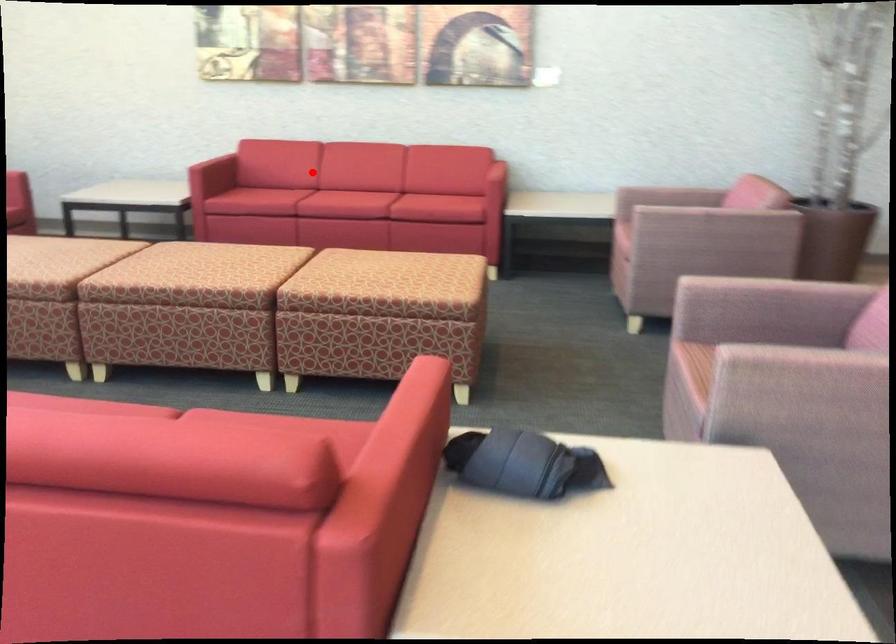
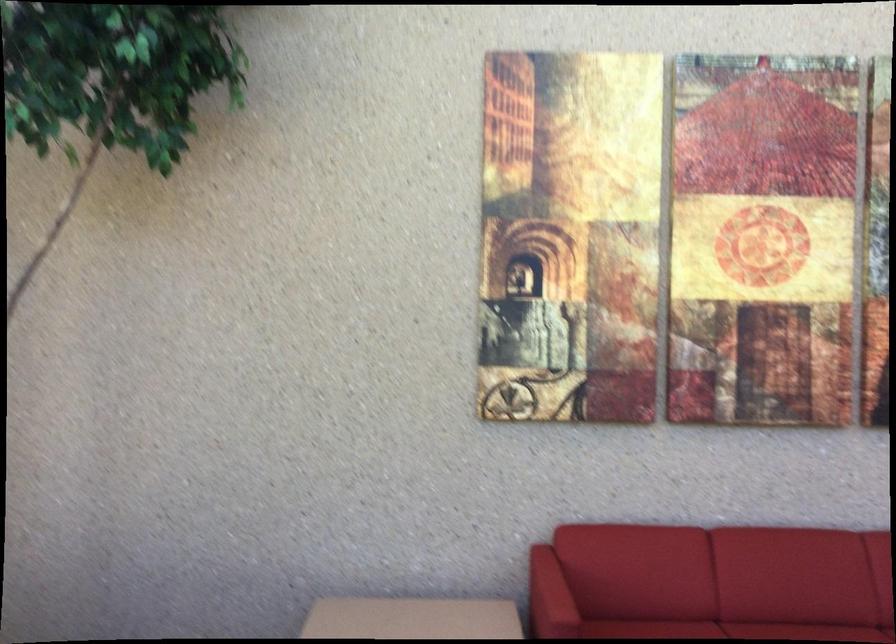
Question: I am providing you with two images of the same scene from different viewpoints. Image1 has a red point marked. In image2, the corresponding 3D location appears at what relative position? Reply with the corresponding letter.

Choices:
 (A) Closer
 (B) Farther

Answer: (A)